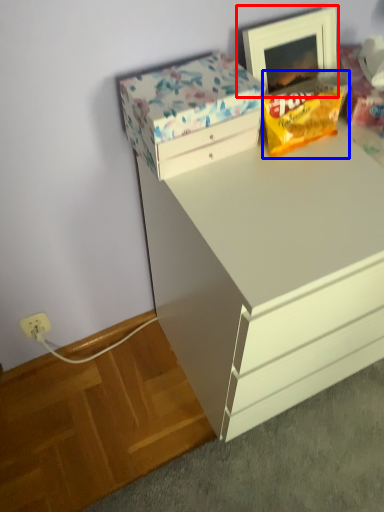
Question: Which point is further to the camera, picture frame (highlighted by a red box) or snack (highlighted by a blue box)?

Choices:
 (A) picture frame
 (B) snack

Answer: (A)